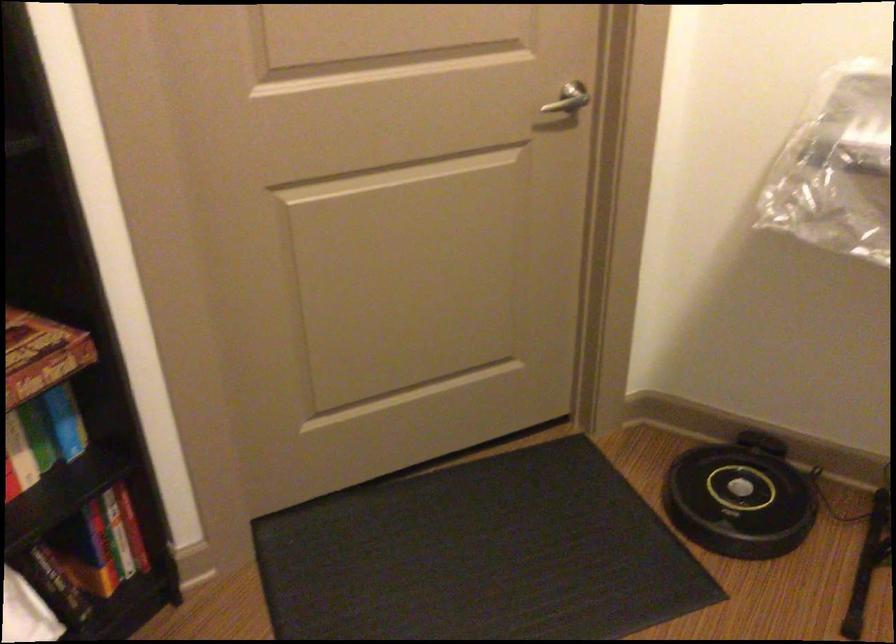
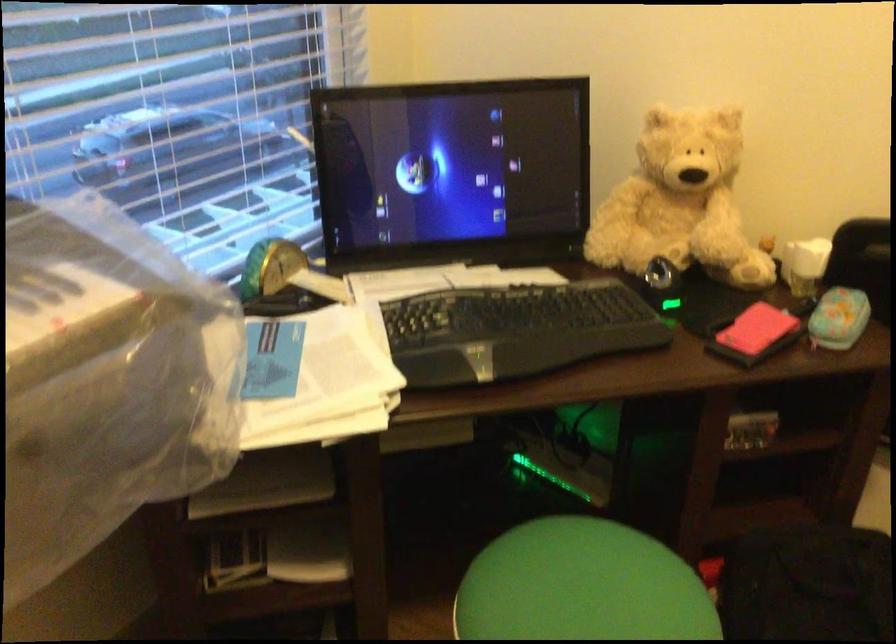
The images are taken continuously from a first-person perspective. In which direction is your viewpoint rotating?

The camera's rotation is toward right-down.